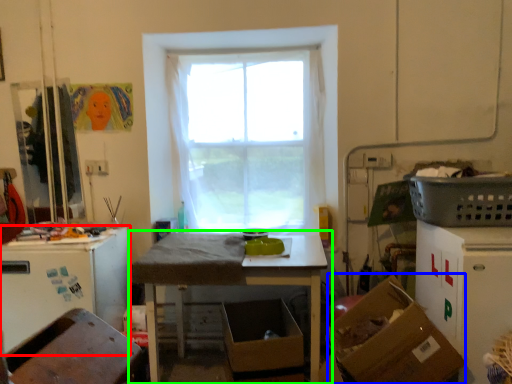
Question: Which object is positioned farthest from leftover (highlighted by a red box)? Select from cardboard box (highlighted by a blue box) and table (highlighted by a green box).

Choices:
 (A) cardboard box
 (B) table

Answer: (A)